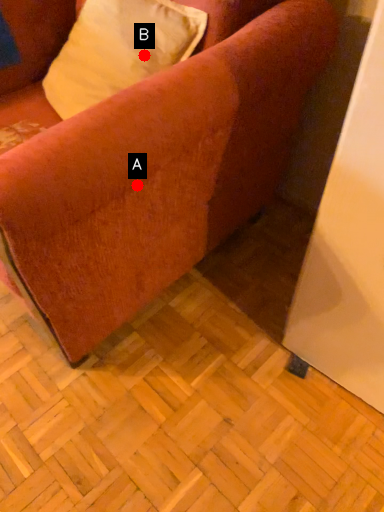
Question: Two points are circled on the image, labeled by A and B beside each circle. Which of the following is the closest to the observer?

Choices:
 (A) A is closer
 (B) B is closer

Answer: (A)